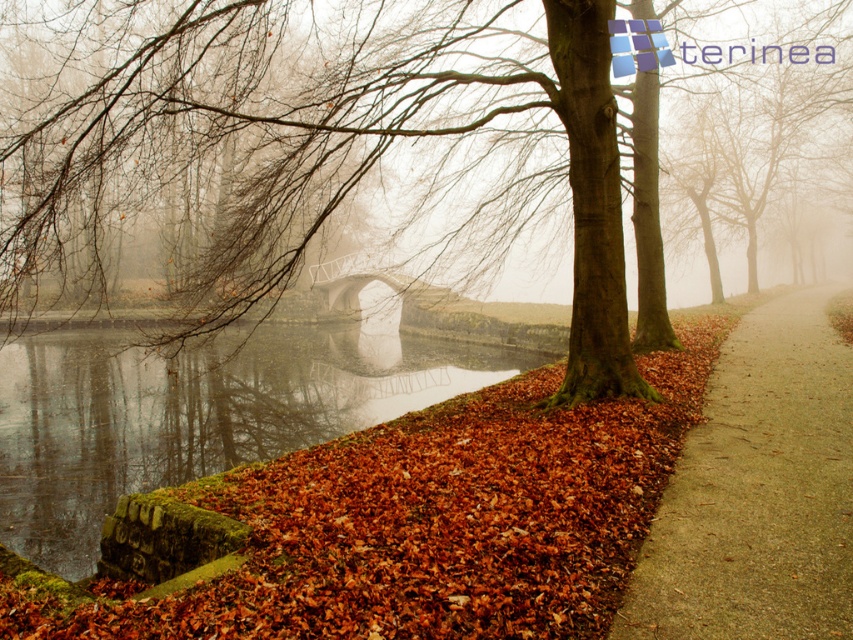
Between brown rough bark tree at center and metallic gray bridge at center, which one has less height?

metallic gray bridge at center is shorter.

Which is below, brown rough bark tree at center or metallic gray bridge at center?

metallic gray bridge at center is lower down.

This screenshot has width=853, height=640. Describe the element at coordinates (332, 145) in the screenshot. I see `brown rough bark tree at center` at that location.

The height and width of the screenshot is (640, 853). In order to click on brown rough bark tree at center in this screenshot , I will do `click(332, 145)`.

Does point (233, 211) lie behind point (746, 557)?

That is True.

Consider the image. Is brown rough bark tree at center below brown gravel path at lower right?

Actually, brown rough bark tree at center is above brown gravel path at lower right.

Where is `brown rough bark tree at center`? This screenshot has width=853, height=640. brown rough bark tree at center is located at coordinates (332, 145).

This screenshot has width=853, height=640. Identify the location of brown rough bark tree at center. (332, 145).

Which is more to the right, brown leafy river at lower left or brown gravel path at lower right?

brown gravel path at lower right is more to the right.

Does brown leafy river at lower left have a larger size compared to brown gravel path at lower right?

Yes.

Find the location of a particular element. This screenshot has height=640, width=853. brown leafy river at lower left is located at coordinates (195, 413).